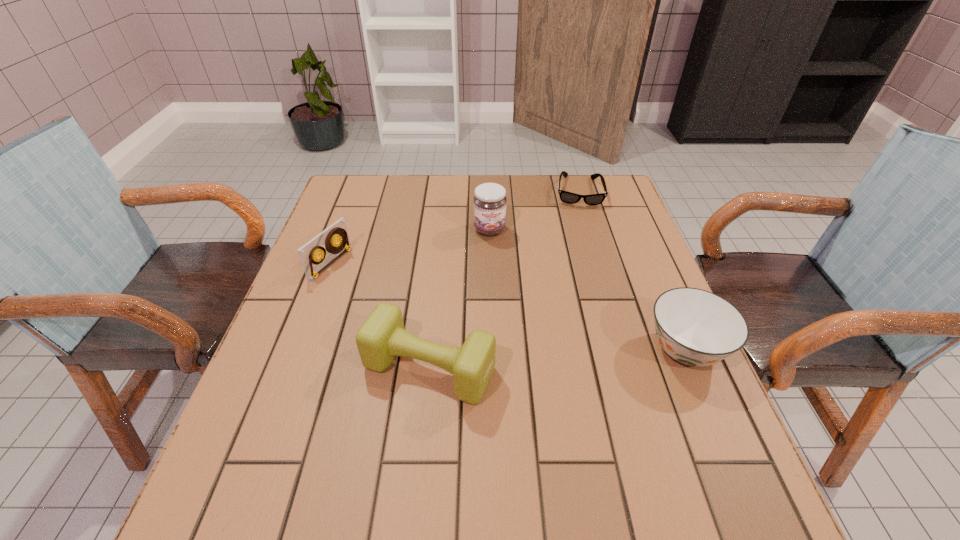
At what (x,y) coordinates should I click in order to perform the action: click on dumbbell. Please return your answer as a coordinate pair (x, y). The width and height of the screenshot is (960, 540). Looking at the image, I should click on (382, 336).

In order to click on soup bowl in this screenshot , I will do `click(695, 327)`.

Locate an element on the screen. the third nearest object is located at coordinates (310, 261).

At what (x,y) coordinates should I click in order to perform the action: click on the leftmost object. Please return your answer as a coordinate pair (x, y). Looking at the image, I should click on (310, 261).

At what (x,y) coordinates should I click in order to perform the action: click on jam. Please return your answer as a coordinate pair (x, y). Looking at the image, I should click on (490, 199).

Image resolution: width=960 pixels, height=540 pixels. Find the location of `the farthest object`. the farthest object is located at coordinates (567, 197).

Locate an element on the screen. This screenshot has height=540, width=960. sunglasses is located at coordinates (567, 197).

Find the location of a particular element. Image resolution: width=960 pixels, height=540 pixels. free space located 0.070m on the left of the dumbbell is located at coordinates (329, 368).

Locate an element on the screen. free space located on the back of the soup bowl is located at coordinates (638, 239).

Identify the location of vacant space located 0.280m at the front of the leftmost object with visible reels. (436, 312).